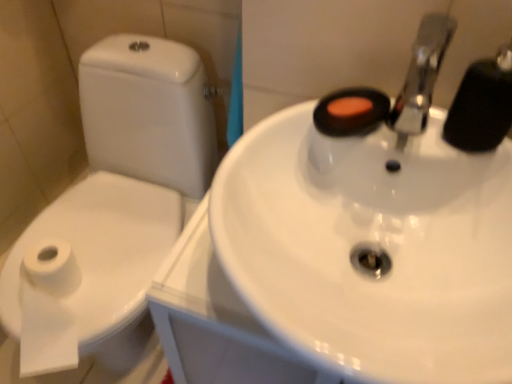
Question: From the image's perspective, is white glossy sink at center on white paper bidet at left?

Choices:
 (A) yes
 (B) no

Answer: (A)

Question: From the image's perspective, does white glossy sink at center appear lower than white paper bidet at left?

Choices:
 (A) yes
 (B) no

Answer: (B)

Question: Is white glossy sink at center positioned behind white paper bidet at left?

Choices:
 (A) yes
 (B) no

Answer: (B)

Question: Can you confirm if white glossy sink at center is thinner than white paper bidet at left?

Choices:
 (A) no
 (B) yes

Answer: (A)

Question: Is white glossy sink at center placed right next to white paper bidet at left?

Choices:
 (A) no
 (B) yes

Answer: (A)

Question: Does white glossy sink at center have a larger size compared to white paper bidet at left?

Choices:
 (A) no
 (B) yes

Answer: (B)

Question: Does white glossy sink at center appear on the right side of black rubber faucet at upper right?

Choices:
 (A) no
 (B) yes

Answer: (A)

Question: Is white glossy sink at center far away from black rubber faucet at upper right?

Choices:
 (A) no
 (B) yes

Answer: (A)

Question: Does white glossy sink at center have a larger size compared to black rubber faucet at upper right?

Choices:
 (A) yes
 (B) no

Answer: (A)

Question: Is white glossy sink at center aimed at black rubber faucet at upper right?

Choices:
 (A) no
 (B) yes

Answer: (A)

Question: Is white glossy sink at center outside black rubber faucet at upper right?

Choices:
 (A) yes
 (B) no

Answer: (A)

Question: Is white glossy sink at center shorter than black rubber faucet at upper right?

Choices:
 (A) no
 (B) yes

Answer: (A)

Question: Considering the relative sizes of black rubber faucet at upper right and white glossy sink at center in the image provided, is black rubber faucet at upper right smaller than white glossy sink at center?

Choices:
 (A) yes
 (B) no

Answer: (A)